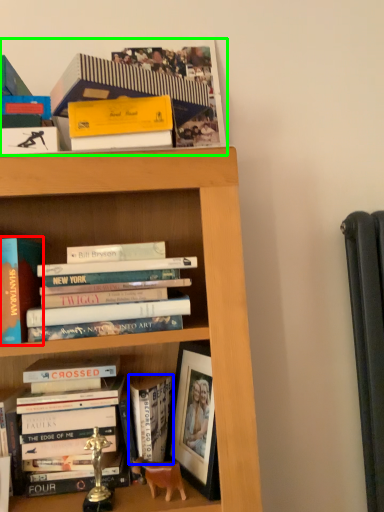
Question: Which object is positioned farthest from book (highlighted by a red box)? Select from book (highlighted by a blue box) and book (highlighted by a green box).

Choices:
 (A) book
 (B) book

Answer: (B)